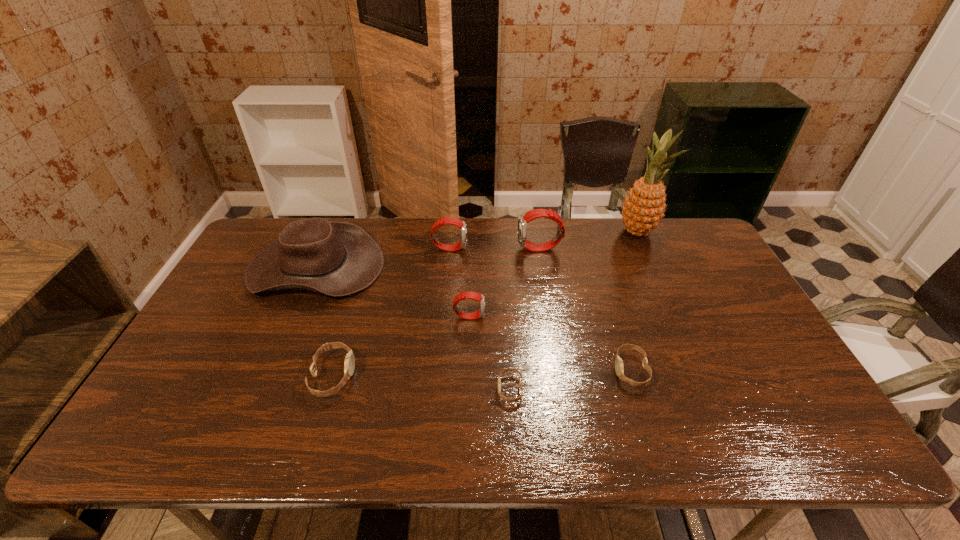
Locate an element on the screen. Image resolution: width=960 pixels, height=540 pixels. the tallest object is located at coordinates (643, 209).

The width and height of the screenshot is (960, 540). I want to click on pineapple, so click(x=643, y=209).

Find the location of a particular element. the rightmost red watch is located at coordinates (536, 213).

Identify the location of the tallest watch. Image resolution: width=960 pixels, height=540 pixels. (536, 213).

Locate an element on the screen. The height and width of the screenshot is (540, 960). cowboy hat is located at coordinates (333, 258).

Locate an element on the screen. This screenshot has height=540, width=960. the fifth shortest object is located at coordinates (450, 220).

Where is `the fifth shortest watch`? This screenshot has width=960, height=540. the fifth shortest watch is located at coordinates (450, 220).

Where is `the fourth nearest object`? This screenshot has height=540, width=960. the fourth nearest object is located at coordinates (464, 295).

Where is `the nearest red watch`? the nearest red watch is located at coordinates (464, 295).

The image size is (960, 540). I want to click on the third shortest object, so click(x=349, y=364).